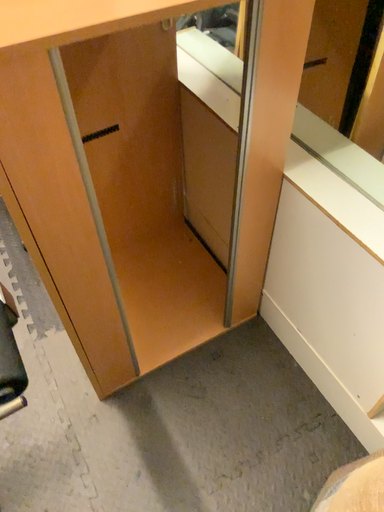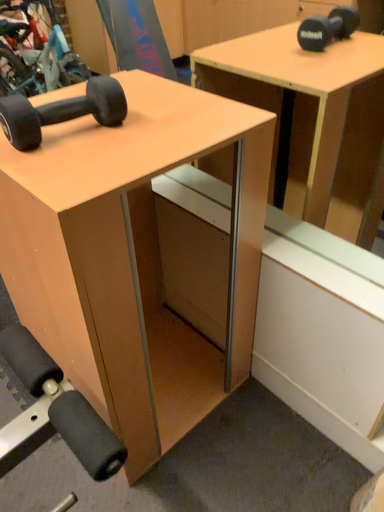
Question: Which way did the camera rotate in the video?

Choices:
 (A) rotated downward
 (B) rotated upward

Answer: (B)